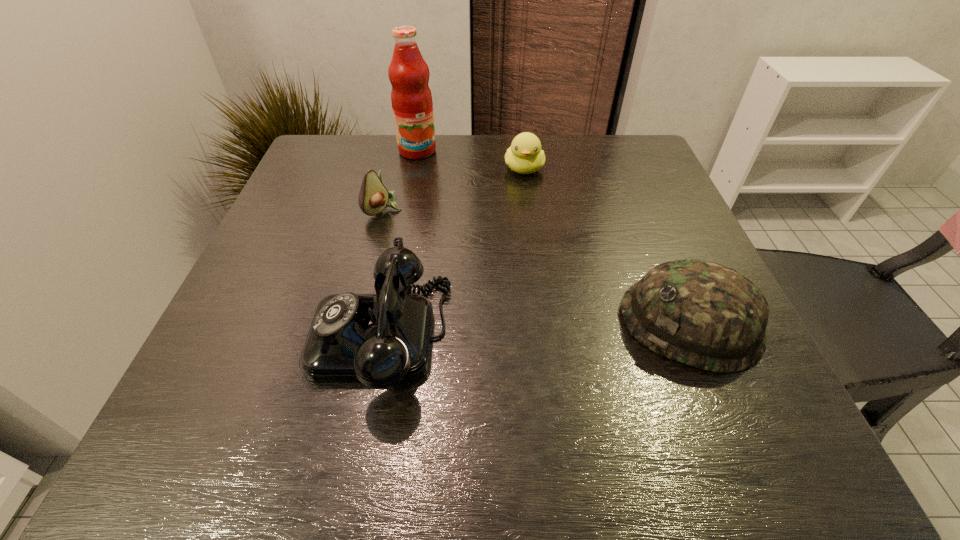
You are a GUI agent. You are given a task and a screenshot of the screen. Output one action in this format:
    pyautogui.click(x=<x>, y=<y>)
    Task: Click on the free space on the desktop that is between the telephone and the rightmost object and is positioned on the seed side of the third nearest object
    The width and height of the screenshot is (960, 540).
    Given the screenshot: What is the action you would take?
    pyautogui.click(x=575, y=328)

At what (x,y) coordinates should I click in order to perform the action: click on free space on the desktop that is between the telephone and the rightmost object and is positioned on the front label of the fruit juice. Please return your answer as a coordinate pair (x, y). Image resolution: width=960 pixels, height=540 pixels. Looking at the image, I should click on (529, 329).

Find the location of a particular element. The image size is (960, 540). vacant space on the desktop that is between the telephone and the rightmost object and is positioned at the beak of the duckling is located at coordinates (521, 330).